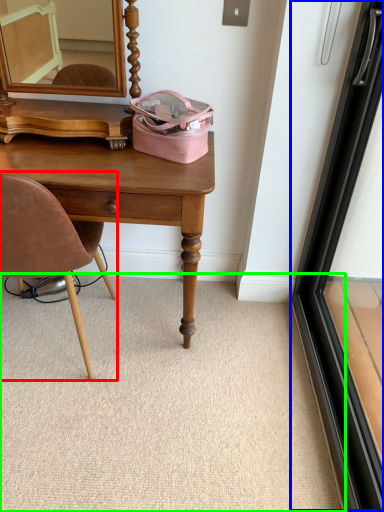
Question: Which is nearer to the chair (highlighted by a red box)? screen door (highlighted by a blue box) or plain (highlighted by a green box).

Choices:
 (A) screen door
 (B) plain

Answer: (B)